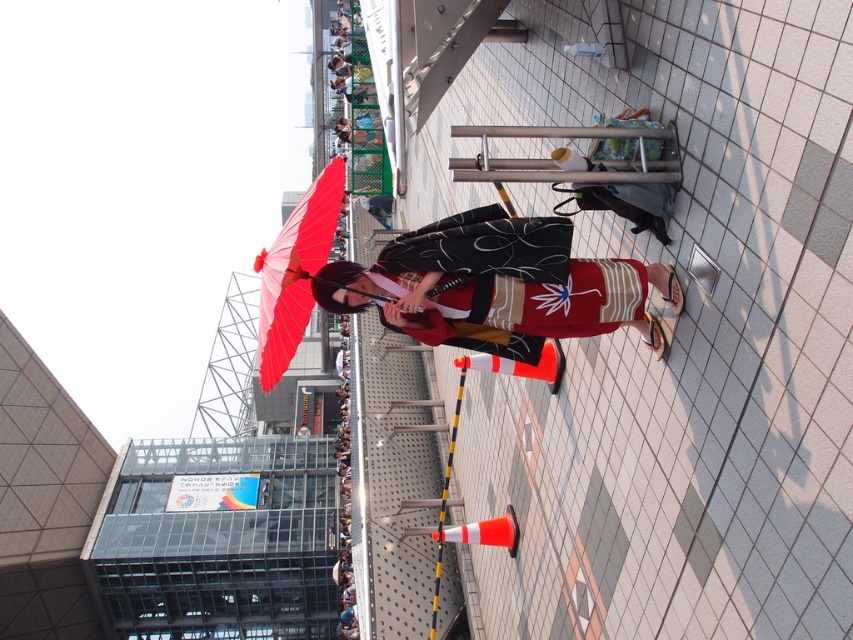
Describe the element at coordinates (514, 298) in the screenshot. I see `matte kimono at center` at that location.

Is matte kimono at center smaller than matte red umbrella at center?

Correct, matte kimono at center occupies less space than matte red umbrella at center.

Between point (556, 307) and point (283, 300), which one is positioned behind?

The point (283, 300) is behind.

The image size is (853, 640). In order to click on matte kimono at center in this screenshot , I will do `click(514, 298)`.